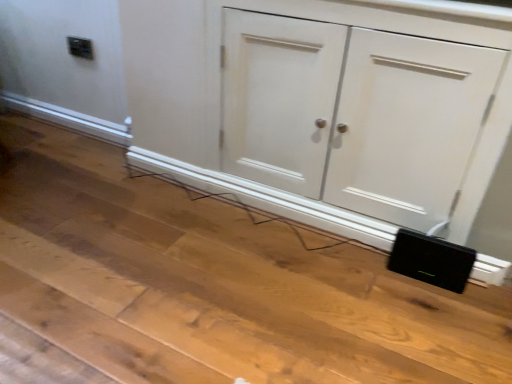
Question: Is black matte speaker at lower right wider or thinner than white matte cupboard at lower right?

Choices:
 (A) thin
 (B) wide

Answer: (A)

Question: From a real-world perspective, is black matte speaker at lower right above or below white matte cupboard at lower right?

Choices:
 (A) above
 (B) below

Answer: (B)

Question: Which is nearer to the white matte cupboard at lower right?

Choices:
 (A) black plastic electric outlet at upper left
 (B) black matte speaker at lower right

Answer: (B)

Question: Which is nearer to the white matte cupboard at lower right?

Choices:
 (A) black matte speaker at lower right
 (B) black plastic electric outlet at upper left

Answer: (A)